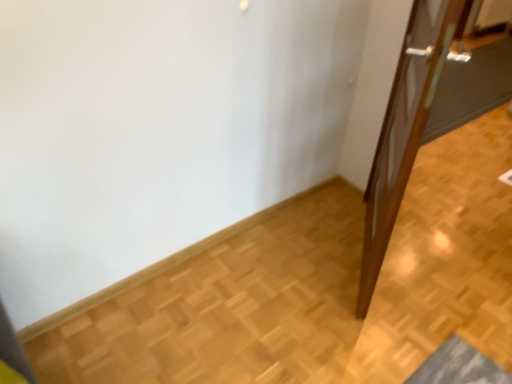
What is the approximate height of matte brown door at right?

matte brown door at right is 1.27 meters tall.

You are a GUI agent. You are given a task and a screenshot of the screen. Output one action in this format:
    pyautogui.click(x=<x>, y=<y>)
    Task: Click on the matte brown door at right
    Image resolution: width=512 pixels, height=384 pixels.
    Given the screenshot: What is the action you would take?
    pyautogui.click(x=405, y=127)

Image resolution: width=512 pixels, height=384 pixels. What do you see at coordinates (405, 127) in the screenshot?
I see `matte brown door at right` at bounding box center [405, 127].

The image size is (512, 384). Find the location of `matte brown door at right`. matte brown door at right is located at coordinates (405, 127).